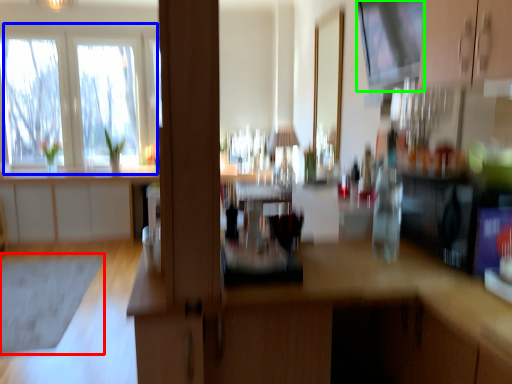
Question: Which is farther away from mat (highlighted by a red box)? window (highlighted by a blue box) or window screen (highlighted by a green box)?

Choices:
 (A) window
 (B) window screen

Answer: (B)